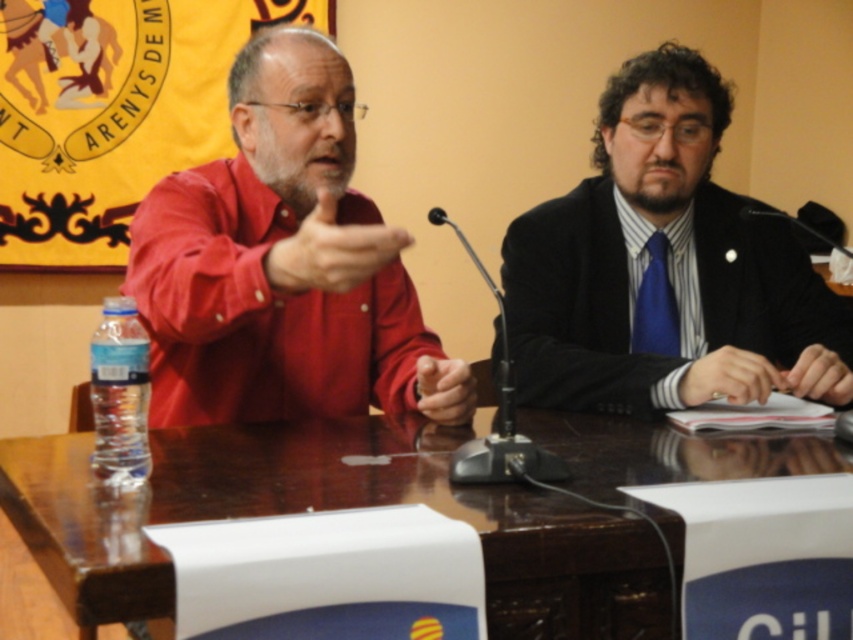
This screenshot has width=853, height=640. What do you see at coordinates (498, 413) in the screenshot? I see `black plastic microphone at center` at bounding box center [498, 413].

Can you confirm if black plastic microphone at center is positioned above black matte paper at center?

Yes, black plastic microphone at center is above black matte paper at center.

This screenshot has width=853, height=640. What do you see at coordinates (498, 413) in the screenshot?
I see `black plastic microphone at center` at bounding box center [498, 413].

Find the location of a particular element. This screenshot has height=640, width=853. black plastic microphone at center is located at coordinates (498, 413).

Is blue silk tie at center to the right of black matte paper at center from the viewer's perspective?

In fact, blue silk tie at center is to the left of black matte paper at center.

Is blue silk tie at center thinner than black matte paper at center?

Yes.

Between point (666, 256) and point (811, 352), which one is positioned in front?

Point (811, 352)

Locate an element on the screen. blue silk tie at center is located at coordinates (654, 305).

Looking at this image, can you confirm if matte red shirt at left is smaller than black plastic microphone at center?

Incorrect, matte red shirt at left is not smaller in size than black plastic microphone at center.

Is matte red shirt at left thinner than black plastic microphone at center?

Incorrect, matte red shirt at left's width is not less than black plastic microphone at center's.

Which is in front, point (265, 136) or point (544, 467)?

Point (544, 467)

Locate an element on the screen. The image size is (853, 640). matte red shirt at left is located at coordinates (276, 259).